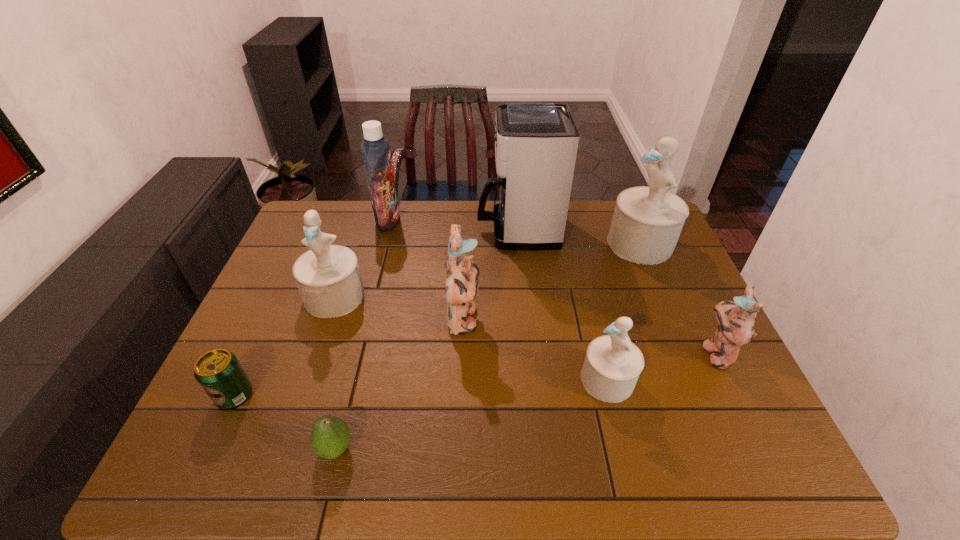
The height and width of the screenshot is (540, 960). What are the coordinates of `vacant space situated 0.210m on the front label of the shampoo` in the screenshot? It's located at (460, 221).

At what (x,y) coordinates should I click in order to perform the action: click on vacant space located 0.360m at the beak of the leftmost figurine. Please return your answer as a coordinate pair (x, y). Image resolution: width=960 pixels, height=540 pixels. Looking at the image, I should click on (285, 443).

This screenshot has height=540, width=960. Identify the location of vacant space situated 0.080m on the front-facing side of the left pink figurine. (509, 320).

This screenshot has width=960, height=540. I want to click on vacant area located 0.370m at the beak of the third figurine from left to right, so pos(429,380).

Identify the location of free space located at the beak of the third figurine from left to right. Image resolution: width=960 pixels, height=540 pixels. (469, 380).

The width and height of the screenshot is (960, 540). I want to click on free region located at the beak of the third figurine from left to right, so click(445, 380).

Identify the location of free space located 0.250m on the front-facing side of the right pink figurine. The height and width of the screenshot is (540, 960). (605, 353).

I want to click on free space located 0.240m on the front-facing side of the right pink figurine, so click(609, 353).

The width and height of the screenshot is (960, 540). Identify the location of free space located on the front-facing side of the right pink figurine. (581, 353).

Find the location of a particular element. vacant area situated on the back of the leftmost object is located at coordinates (283, 290).